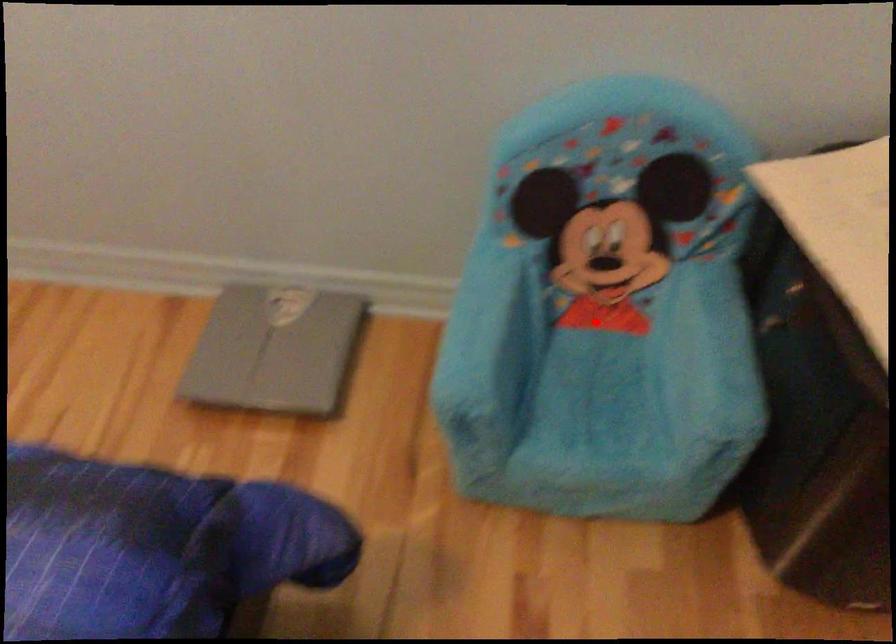
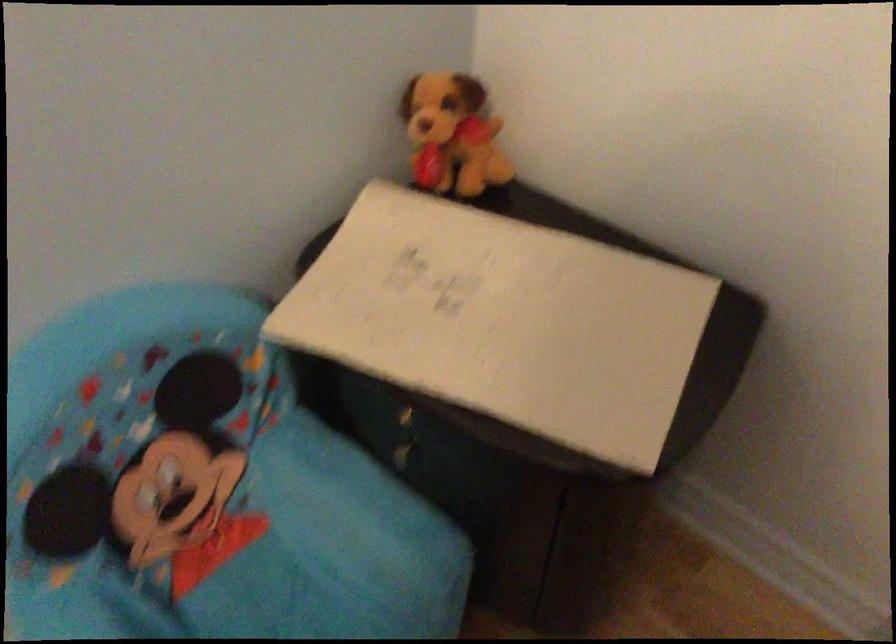
Where in the second image is the point corresponding to the highlighted location from the first image?

(220, 554)